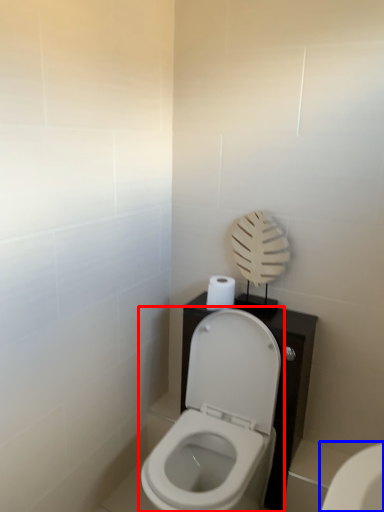
Question: Among these objects, which one is farthest to the camera, toilet (highlighted by a red box) or toilet (highlighted by a blue box)?

Choices:
 (A) toilet
 (B) toilet

Answer: (B)